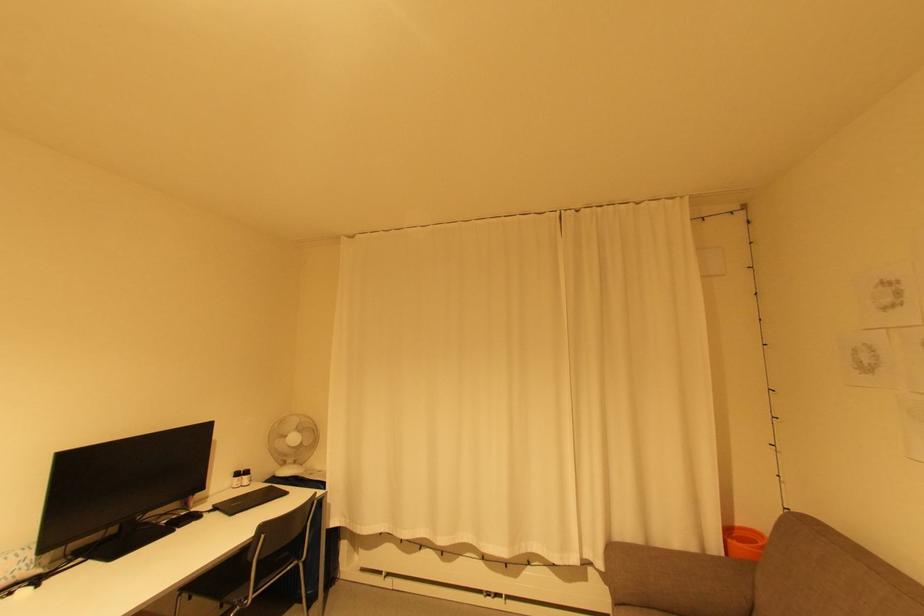
Locate an element on the screen. The height and width of the screenshot is (616, 924). chair sitting surface is located at coordinates (277, 551).